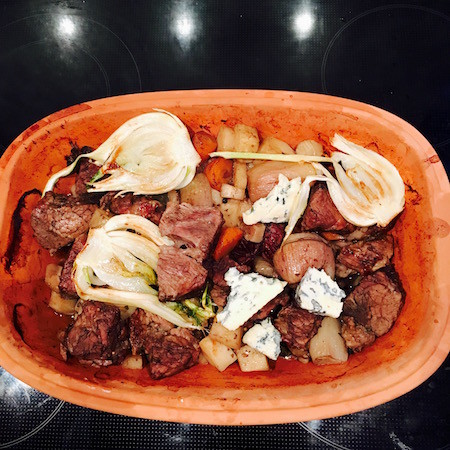
The height and width of the screenshot is (450, 450). I want to click on bowl, so click(285, 109).